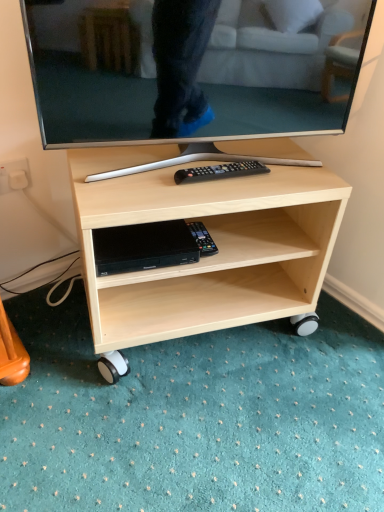
Question: From the image's perspective, is black plastic dvd player at lower center under matte black tv at center?

Choices:
 (A) no
 (B) yes

Answer: (B)

Question: Is black plastic dvd player at lower center further to camera compared to matte black tv at center?

Choices:
 (A) no
 (B) yes

Answer: (B)

Question: Is black plastic dvd player at lower center positioned in front of matte black tv at center?

Choices:
 (A) no
 (B) yes

Answer: (A)

Question: Considering the relative sizes of black plastic dvd player at lower center and matte black tv at center in the image provided, is black plastic dvd player at lower center taller than matte black tv at center?

Choices:
 (A) no
 (B) yes

Answer: (A)

Question: From the image's perspective, is black plastic dvd player at lower center above matte black tv at center?

Choices:
 (A) yes
 (B) no

Answer: (B)

Question: In terms of height, does light wood/texture tv stand at center look taller or shorter compared to black plastic remote control at center?

Choices:
 (A) short
 (B) tall

Answer: (B)

Question: In terms of width, does light wood/texture tv stand at center look wider or thinner when compared to black plastic remote control at center?

Choices:
 (A) thin
 (B) wide

Answer: (B)

Question: Choose the correct answer: Is light wood/texture tv stand at center inside black plastic remote control at center or outside it?

Choices:
 (A) outside
 (B) inside

Answer: (A)

Question: Based on their positions, is light wood/texture tv stand at center located to the left or right of black plastic remote control at center?

Choices:
 (A) left
 (B) right

Answer: (A)

Question: Considering the positions of black plastic remote control at center and black plastic remote at center in the image, is black plastic remote control at center wider or thinner than black plastic remote at center?

Choices:
 (A) thin
 (B) wide

Answer: (B)

Question: Is point (200, 224) positioned closer to the camera than point (231, 173)?

Choices:
 (A) farther
 (B) closer

Answer: (A)

Question: Relative to black plastic remote at center, is black plastic remote control at center in front or behind?

Choices:
 (A) behind
 (B) front

Answer: (A)

Question: Is black plastic remote control at center spatially inside black plastic remote at center, or outside of it?

Choices:
 (A) outside
 (B) inside

Answer: (A)

Question: Is matte black tv at center inside the boundaries of black plastic remote control at center, or outside?

Choices:
 (A) inside
 (B) outside

Answer: (B)

Question: From a real-world perspective, is matte black tv at center above or below black plastic remote control at center?

Choices:
 (A) below
 (B) above

Answer: (B)